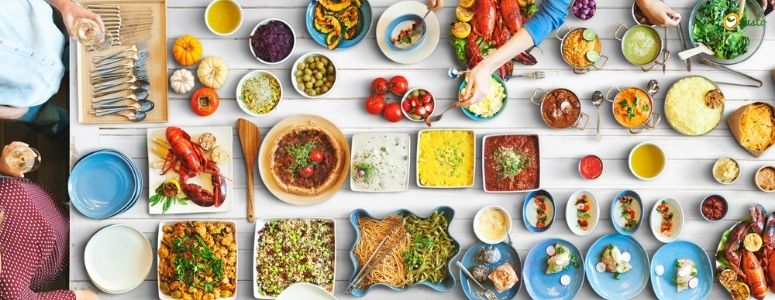
Find the location of `vegetable sitting on table`. vegetable sitting on table is located at coordinates (394, 110), (398, 84), (374, 85), (372, 106), (202, 107), (209, 72), (176, 78), (181, 56).